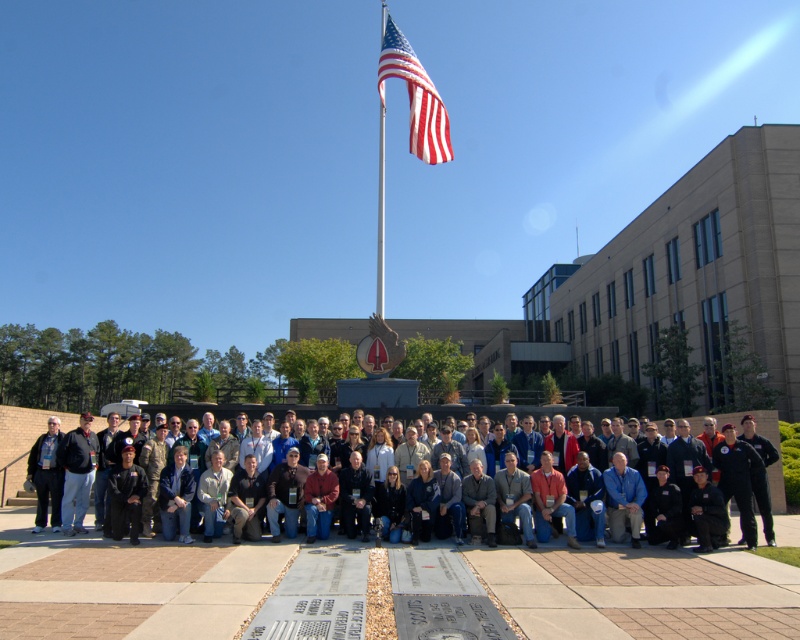
Question: Is dark blue uniform at center further to camera compared to dark gray jacket at lower left?

Choices:
 (A) no
 (B) yes

Answer: (A)

Question: Which point is farther to the camera?

Choices:
 (A) (52, 440)
 (B) (72, 422)
 (C) (381, 198)

Answer: (C)

Question: Is red-white striped fabric flag at upper center above dark gray jacket at lower left?

Choices:
 (A) no
 (B) yes

Answer: (B)

Question: Among these points, which one is farthest from the camera?

Choices:
 (A) (380, 300)
 (B) (398, 54)
 (C) (54, 442)

Answer: (B)

Question: Is dark blue uniform at center thinner than red-white striped fabric flag at upper center?

Choices:
 (A) yes
 (B) no

Answer: (B)

Question: Which object is the farthest from the red-white striped fabric flag at upper center?

Choices:
 (A) dark gray jacket at lower left
 (B) dark blue uniform at center
 (C) polished metal flag pole at upper center

Answer: (C)